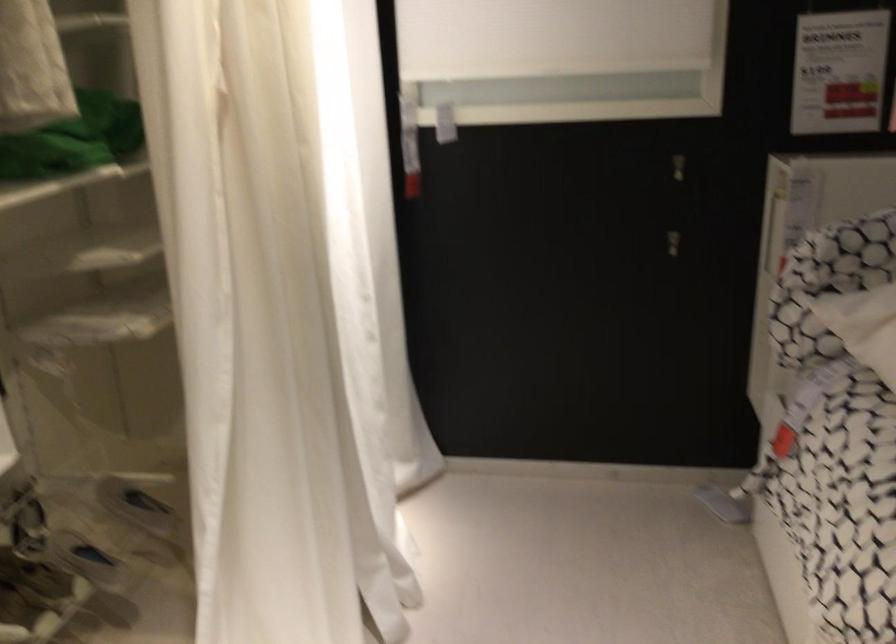
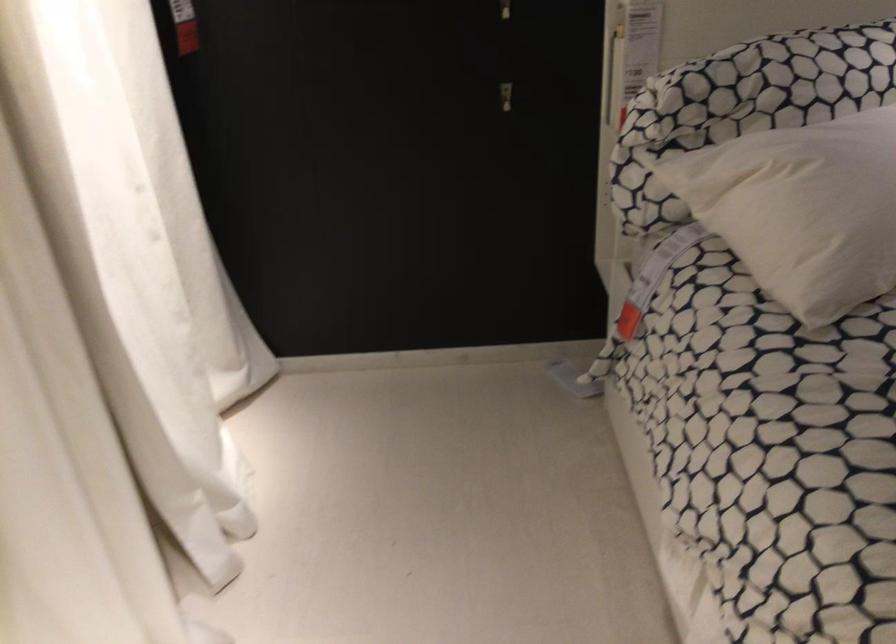
Question: The images are taken continuously from a first-person perspective. In which direction is your viewpoint rotating?

Choices:
 (A) Left
 (B) Right
 (C) Up
 (D) Down

Answer: (D)